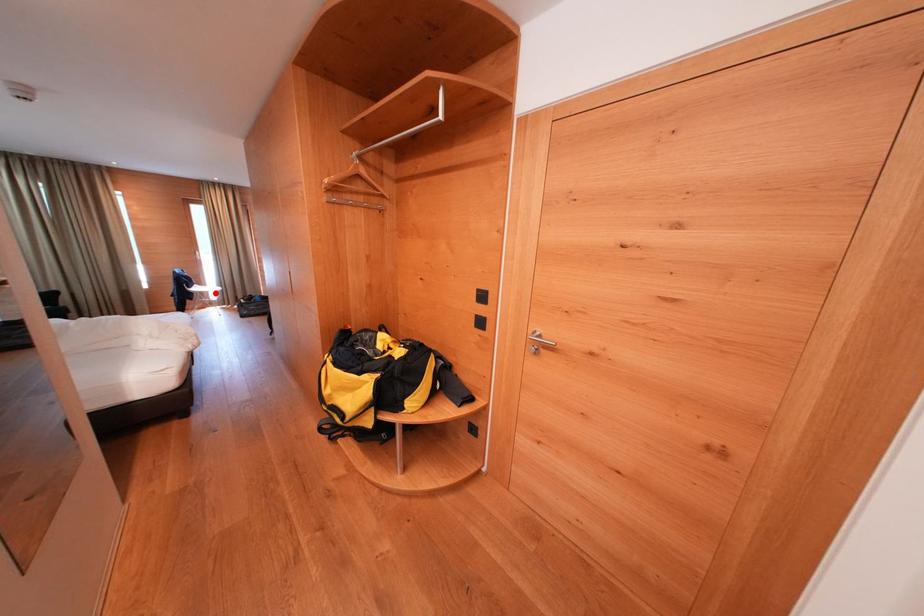
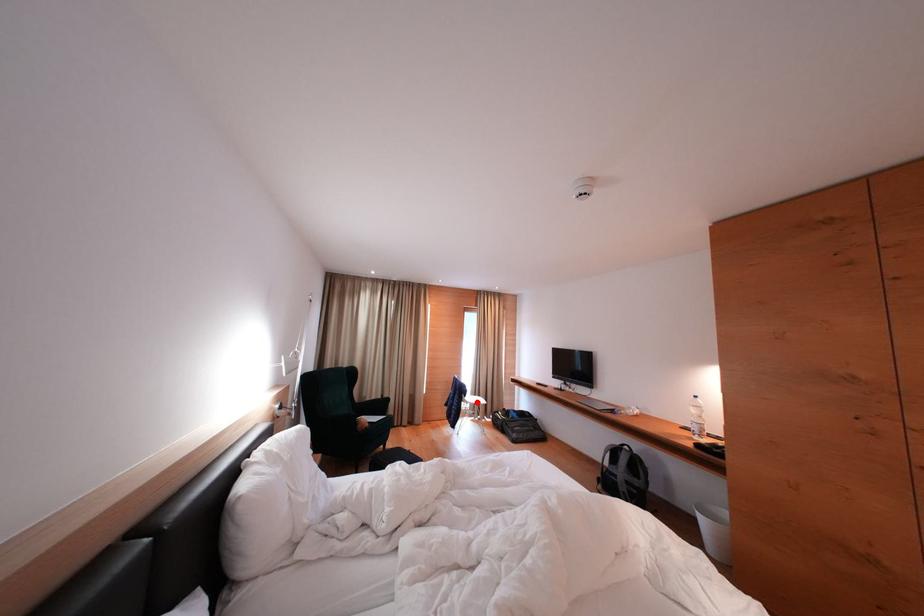
I am providing you with two images of the same scene from different viewpoints. A red point is marked on the first image and another point is marked on the second image. Do the highlighted points in image1 and image2 indicate the same real-world spot?

Yes